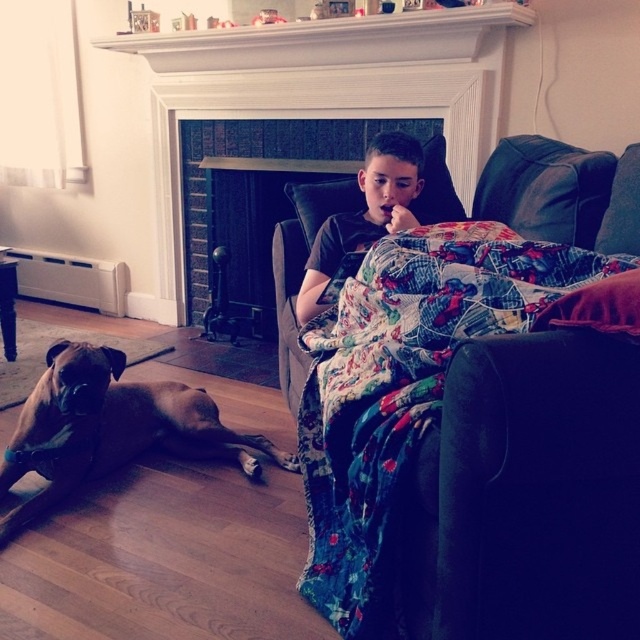
Does floral cotton quilt at upper right appear on the left side of black cotton shirt at center?

No, floral cotton quilt at upper right is not to the left of black cotton shirt at center.

Between point (433, 358) and point (321, 273), which one is positioned behind?

The point (321, 273) is behind.

You are a GUI agent. You are given a task and a screenshot of the screen. Output one action in this format:
    pyautogui.click(x=<x>, y=<y>)
    Task: Click on the floral cotton quilt at upper right
    This screenshot has width=640, height=640.
    Given the screenshot: What is the action you would take?
    pyautogui.click(x=404, y=388)

At what (x,y) coordinates should I click in order to perform the action: click on brown smooth dog at left. Please return your answer as a coordinate pair (x, y). Looking at the image, I should click on (109, 428).

Is point (93, 390) farther from viewer compared to point (369, 154)?

No, (93, 390) is closer to viewer.

Locate an element on the screen. This screenshot has width=640, height=640. brown smooth dog at left is located at coordinates (109, 428).

Which is above, floral cotton quilt at upper right or brick fireplace at center?

Positioned higher is brick fireplace at center.

Does floral cotton quilt at upper right have a lesser width compared to brick fireplace at center?

Indeed, floral cotton quilt at upper right has a lesser width compared to brick fireplace at center.

Which is behind, point (496, 317) or point (180, 291)?

The point (180, 291) is behind.

Identify the location of floral cotton quilt at upper right. Image resolution: width=640 pixels, height=640 pixels. (404, 388).